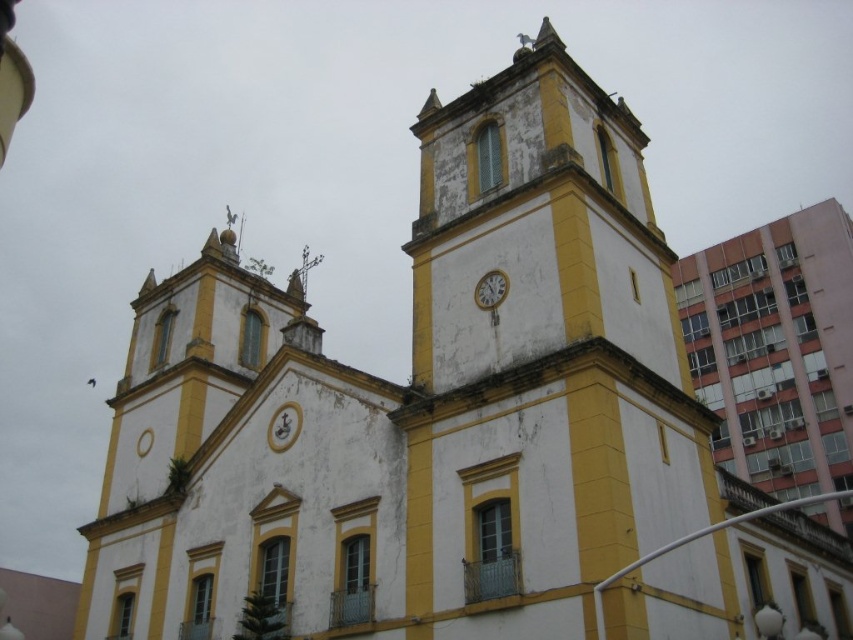
Question: Which point appears farthest from the camera in this image?

Choices:
 (A) (581, 618)
 (B) (502, 272)

Answer: (B)

Question: Is yellow matte clock tower at center to the right of metallic silver clock at center from the viewer's perspective?

Choices:
 (A) no
 (B) yes

Answer: (B)

Question: Does yellow matte clock tower at center appear under metallic silver clock at center?

Choices:
 (A) no
 (B) yes

Answer: (A)

Question: From the image, what is the correct spatial relationship of yellow matte clock tower at center in relation to metallic silver clock at center?

Choices:
 (A) left
 (B) right

Answer: (B)

Question: Among these objects, which one is farthest from the camera?

Choices:
 (A) yellow matte clock tower at center
 (B) metallic silver clock at center

Answer: (B)